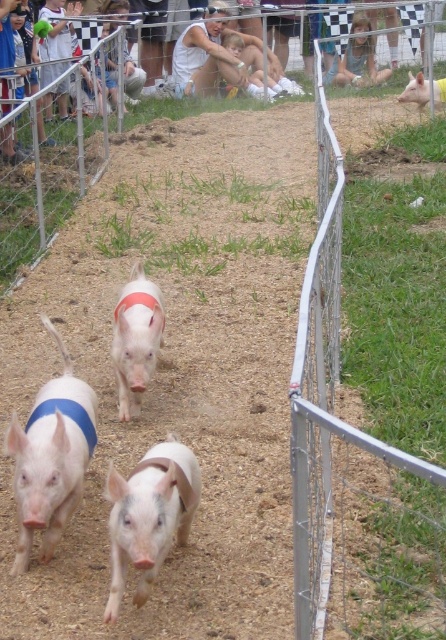
In the scene shown: You are a photographer positioned at the origin point. You want to take a photo of the pink fabric pig at center. What are the coordinates where you should aim your camera?

The coordinates to aim the camera are at point (50, 458).

You are a photographer standing at the starting line of the pig race. You want to take a photo that includes both the point at coordinates point (x=124, y=384) and point (x=421, y=86). Which point will appear larger in your photo?

Point (x=124, y=384) is closer to the camera than point (x=421, y=86), so it will appear larger in the photo.